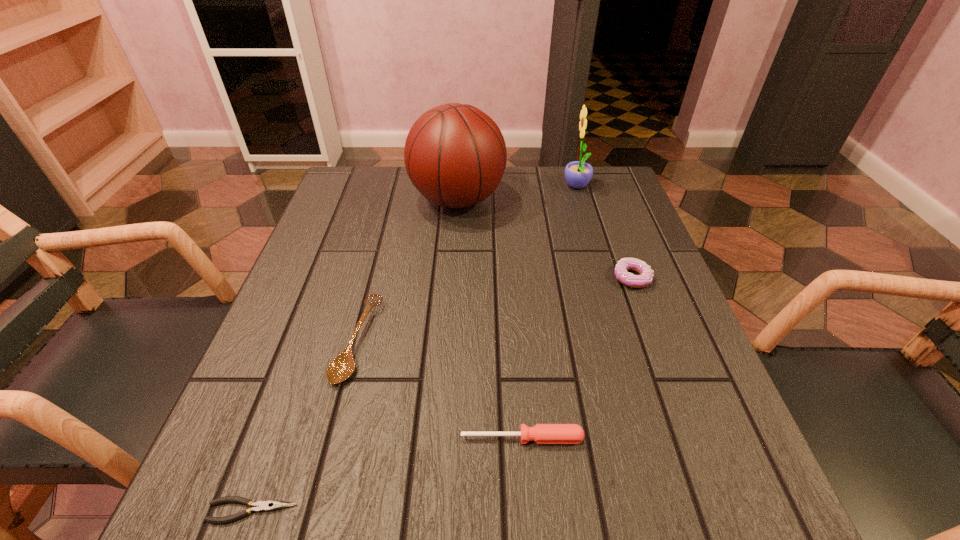
The image size is (960, 540). In order to click on basketball in this screenshot , I will do `click(455, 155)`.

This screenshot has width=960, height=540. I want to click on sunflower, so click(578, 174).

You are a GUI agent. You are given a task and a screenshot of the screen. Output one action in this format:
    pyautogui.click(x=<x>, y=<y>)
    Task: Click on the fourth shortest object
    The height and width of the screenshot is (540, 960).
    Given the screenshot: What is the action you would take?
    pyautogui.click(x=645, y=278)

This screenshot has height=540, width=960. In order to click on doughnut in this screenshot , I will do `click(645, 278)`.

Where is `ladle`? The image size is (960, 540). ladle is located at coordinates (340, 368).

Find the location of a particular element. The width and height of the screenshot is (960, 540). the fifth farthest object is located at coordinates (541, 433).

Find the location of a particular element. The height and width of the screenshot is (540, 960). the nearest object is located at coordinates (270, 505).

The height and width of the screenshot is (540, 960). Find the location of `pliers`. pliers is located at coordinates (270, 505).

Identify the location of vacant space located 0.130m on the left of the basketball. (361, 200).

Locate an element on the screen. free space located on the front-facing side of the sunflower is located at coordinates (420, 187).